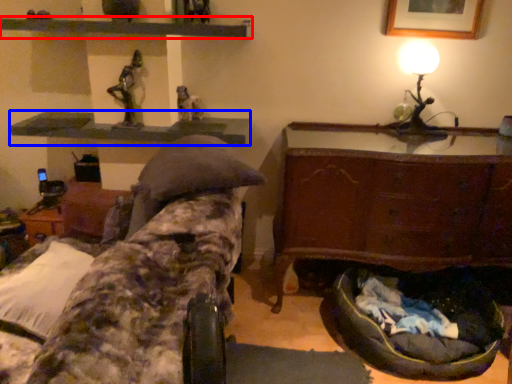
Question: Which object is closer to the camera taking this photo, shelf (highlighted by a red box) or shelf (highlighted by a blue box)?

Choices:
 (A) shelf
 (B) shelf

Answer: (A)